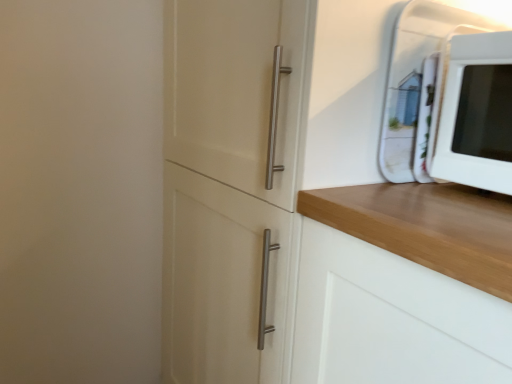
Locate an element on the screen. Image resolution: width=512 pixels, height=384 pixels. white glossy microwave at upper right is located at coordinates (476, 114).

What do you see at coordinates (476, 114) in the screenshot? The width and height of the screenshot is (512, 384). I see `white glossy microwave at upper right` at bounding box center [476, 114].

Locate an element on the screen. The height and width of the screenshot is (384, 512). white glossy microwave at upper right is located at coordinates (476, 114).